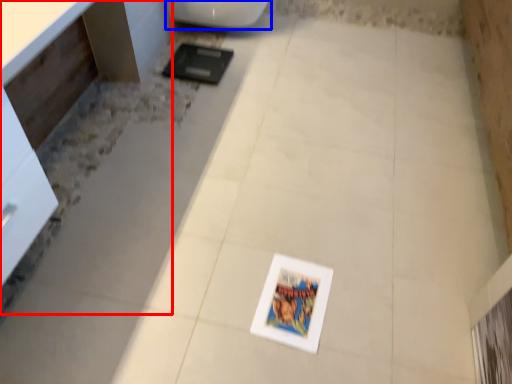
Question: Which object appears closest to the camera in this image, vanity (highlighted by a red box) or toilet (highlighted by a blue box)?

Choices:
 (A) vanity
 (B) toilet

Answer: (A)